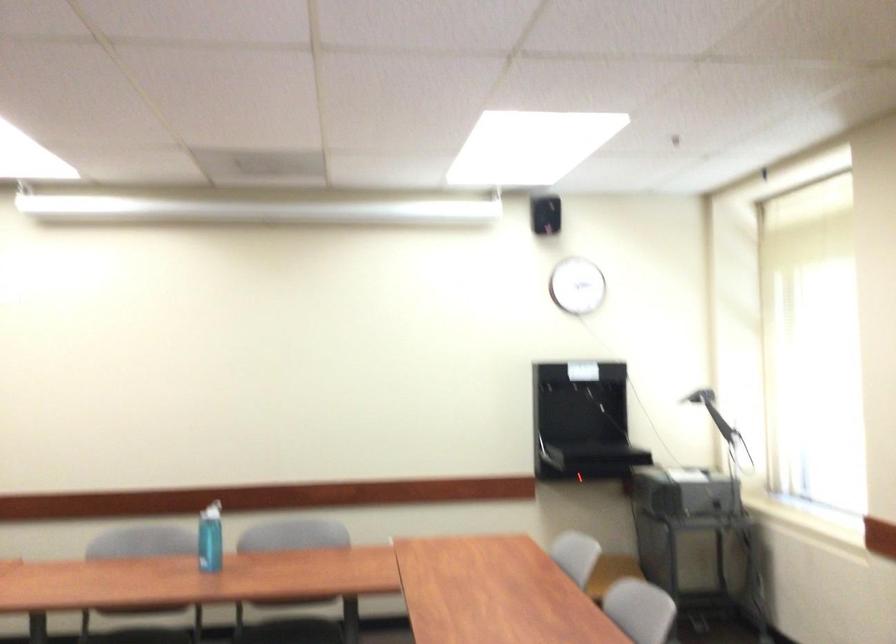
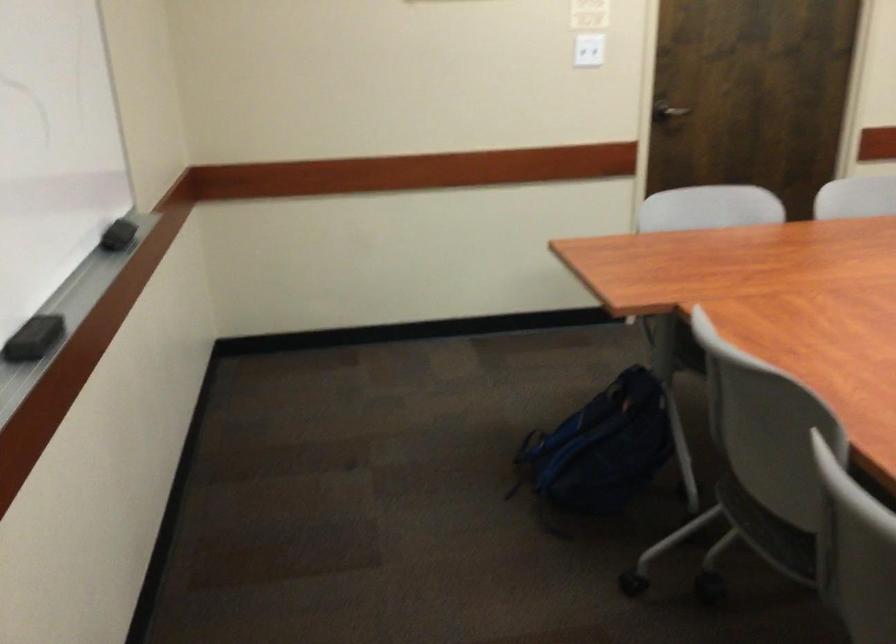
Looking at this image, how did the camera likely rotate?

The rotation direction of the camera is left-down.